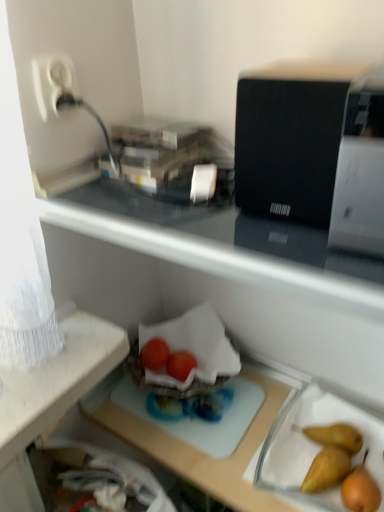
Where is `vacant area that lies in front of glossy plastic tomatoes at center, the first green vegetables when ordered from left to right`? This screenshot has height=512, width=384. vacant area that lies in front of glossy plastic tomatoes at center, the first green vegetables when ordered from left to right is located at coordinates (174, 412).